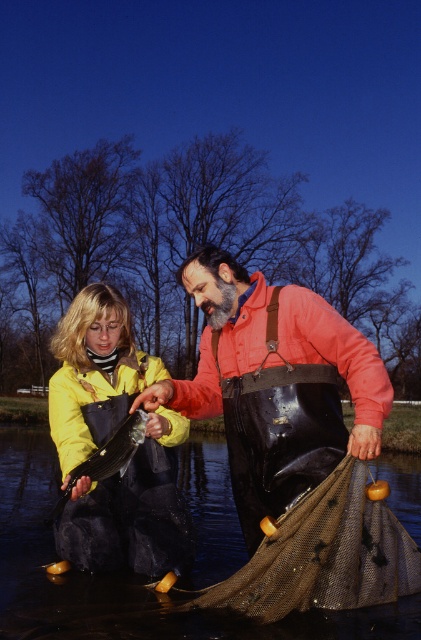
You are a photographer standing at the edge of the riverbank. You need to capture a photo of the black rubber boots at lower center. Where exactly should you position your camera to ensure the boots are centered in the frame?

To center the black rubber boots at lower center in the frame, position your camera at the coordinates provided by the point mentioned in the description, which is at point (127,579).